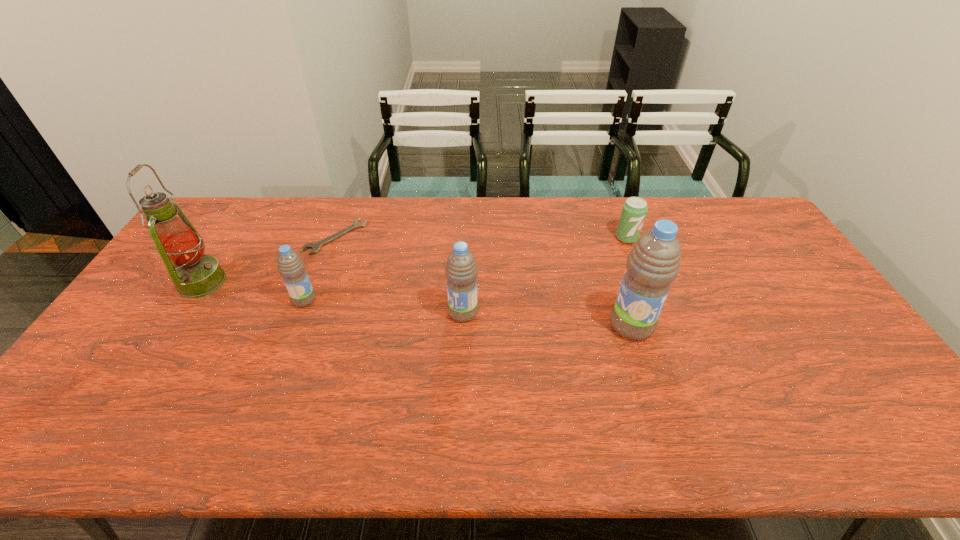
I want to click on the leftmost water bottle, so click(291, 267).

Find the location of a particular element. The width and height of the screenshot is (960, 540). the third shortest object is located at coordinates (291, 267).

Identify the location of the third tallest object. (461, 270).

You are a GUI agent. You are given a task and a screenshot of the screen. Output one action in this format:
    pyautogui.click(x=<x>, y=<y>)
    Task: Click on the fourth object from left to right
    
    Given the screenshot: What is the action you would take?
    pyautogui.click(x=461, y=270)

Where is `the tallest water bottle`? Image resolution: width=960 pixels, height=540 pixels. the tallest water bottle is located at coordinates (653, 264).

The width and height of the screenshot is (960, 540). Identify the location of soda. (634, 210).

In order to click on wrench in this screenshot , I will do `click(315, 246)`.

Locate an element on the screen. Image resolution: width=960 pixels, height=540 pixels. the leftmost object is located at coordinates (195, 275).

Where is `vacant space situated 0.050m on the back of the shortest water bottle`? The image size is (960, 540). vacant space situated 0.050m on the back of the shortest water bottle is located at coordinates (312, 280).

The image size is (960, 540). Find the location of `free region located on the front of the second shortest water bottle`. free region located on the front of the second shortest water bottle is located at coordinates (462, 350).